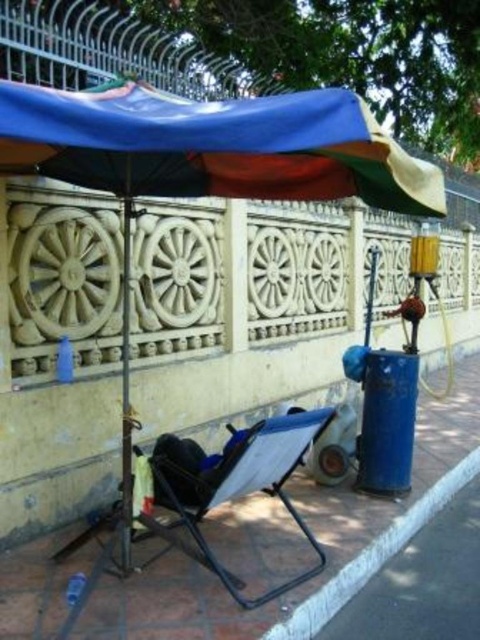
You are a person who is 1.8 meters tall. You are standing in front of the blue fabric chair at lower center and the metallic pole at center. Which object is taller than you?

The metallic pole at center is taller than you since the blue fabric chair at lower center has a lesser height compared to metallic pole at center, and you are 1.8 meters tall.

You are a delivery person carrying a package that requires a 10 feet clearance to maneuver. You need to pass between the blue fabric umbrella at upper center and the blue fabric chair at lower center. Is there enough space for you to pass through?

The distance between the blue fabric umbrella at upper center and the blue fabric chair at lower center is 7.67 feet, which is less than the required 10 feet clearance. Therefore, there is not enough space to pass through with the package.

You are standing at the point marked by the coordinate point at point (x=214, y=145). Looking towards the decorative wall with large wheel designs, which object is directly in front of you?

The blue fabric umbrella at upper center is located at point (x=214, y=145), so it is directly in front of you.